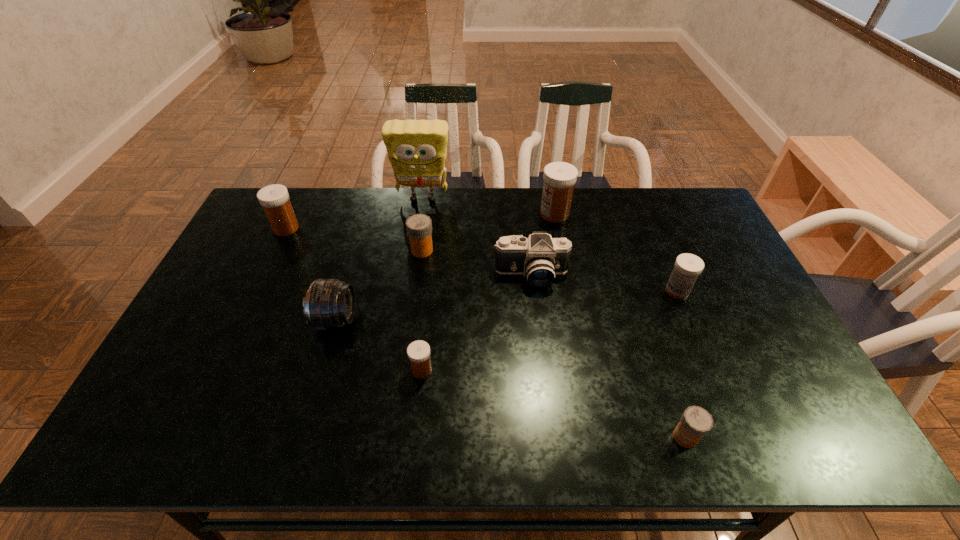
Where is `sponge`? sponge is located at coordinates (417, 149).

Find the location of a particular element. The height and width of the screenshot is (540, 960). the third medicine from right to left is located at coordinates (559, 178).

The width and height of the screenshot is (960, 540). I want to click on the tallest medicine, so click(559, 178).

Where is `the third smallest white medicine`? The width and height of the screenshot is (960, 540). the third smallest white medicine is located at coordinates (274, 199).

This screenshot has height=540, width=960. In order to click on the leftmost object in this screenshot , I will do `click(274, 199)`.

Where is `black camera`? black camera is located at coordinates (539, 257).

You are a GUI agent. You are given a task and a screenshot of the screen. Output one action in this format:
    pyautogui.click(x=<x>, y=<y>)
    Task: Click on the eighth object from right to left
    Image resolution: width=960 pixels, height=540 pixels.
    Given the screenshot: What is the action you would take?
    pyautogui.click(x=329, y=303)

You are a GUI agent. You are given a task and a screenshot of the screen. Output one action in this format:
    pyautogui.click(x=<x>, y=<y>)
    Task: Click on the telephoto lens
    
    Given the screenshot: What is the action you would take?
    pyautogui.click(x=329, y=303)

The width and height of the screenshot is (960, 540). In order to click on the left orange medicine in this screenshot , I will do `click(419, 226)`.

Locate an element on the screen. the bigger orange medicine is located at coordinates (419, 226).